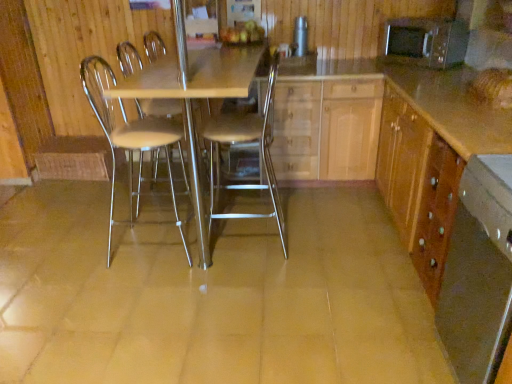
Question: Can you confirm if metallic microwave at upper right, the 1th appliance positioned from the right, is positioned to the left of wooden cabinet at right, the second cabinetry viewed from the left?

Choices:
 (A) no
 (B) yes

Answer: (A)

Question: Can you confirm if metallic microwave at upper right, acting as the 2th appliance starting from the left, is positioned to the right of wooden cabinet at right, the second cabinetry viewed from the left?

Choices:
 (A) no
 (B) yes

Answer: (B)

Question: Considering the relative sizes of metallic microwave at upper right, the 1th appliance positioned from the right, and wooden cabinet at right, which is the 1th cabinetry from right to left, in the image provided, is metallic microwave at upper right, the 1th appliance positioned from the right, taller than wooden cabinet at right, which is the 1th cabinetry from right to left,?

Choices:
 (A) no
 (B) yes

Answer: (A)

Question: Could you tell me if metallic microwave at upper right, the 1th appliance positioned from the right, is facing wooden cabinet at right, which is the 1th cabinetry from right to left?

Choices:
 (A) no
 (B) yes

Answer: (A)

Question: Does metallic microwave at upper right, acting as the 2th appliance starting from the left, have a lesser width compared to wooden cabinet at right, the second cabinetry viewed from the left?

Choices:
 (A) no
 (B) yes

Answer: (B)

Question: Is point (309, 124) positioned closer to the camera than point (441, 322)?

Choices:
 (A) closer
 (B) farther

Answer: (B)

Question: In the image, is light wood/texture cabinet at center, acting as the 2th cabinetry starting from the right, positioned in front of or behind wooden drawer at lower right?

Choices:
 (A) behind
 (B) front

Answer: (A)

Question: From their relative heights in the image, would you say light wood/texture cabinet at center, placed as the first cabinetry when sorted from left to right, is taller or shorter than wooden drawer at lower right?

Choices:
 (A) tall
 (B) short

Answer: (A)

Question: Is light wood/texture cabinet at center, acting as the 2th cabinetry starting from the right, situated inside wooden drawer at lower right or outside?

Choices:
 (A) inside
 (B) outside

Answer: (B)

Question: Is metallic silver chair at center, which appears as the 1th chair when viewed from the left, situated inside metallic silver chair at center, which is counted as the first chair, starting from the right, or outside?

Choices:
 (A) inside
 (B) outside

Answer: (B)

Question: In the image, is metallic silver chair at center, which appears as the 1th chair when viewed from the left, on the left side or the right side of metallic silver chair at center, which is counted as the first chair, starting from the right?

Choices:
 (A) right
 (B) left

Answer: (B)

Question: Based on their sizes in the image, would you say metallic silver chair at center, the 2th chair when ordered from right to left, is bigger or smaller than metallic silver chair at center, the second chair when ordered from left to right?

Choices:
 (A) small
 (B) big

Answer: (A)

Question: From the image's perspective, is metallic silver chair at center, the 2th chair when ordered from right to left, positioned above or below metallic silver chair at center, which is counted as the first chair, starting from the right?

Choices:
 (A) above
 (B) below

Answer: (B)

Question: Looking at the image, does wooden cabinet at right, which is the 1th cabinetry from right to left, seem bigger or smaller compared to metallic silver chair at center, the second chair when ordered from left to right?

Choices:
 (A) small
 (B) big

Answer: (B)

Question: Is wooden cabinet at right, which is the 1th cabinetry from right to left, wider or thinner than metallic silver chair at center, the second chair when ordered from left to right?

Choices:
 (A) wide
 (B) thin

Answer: (A)